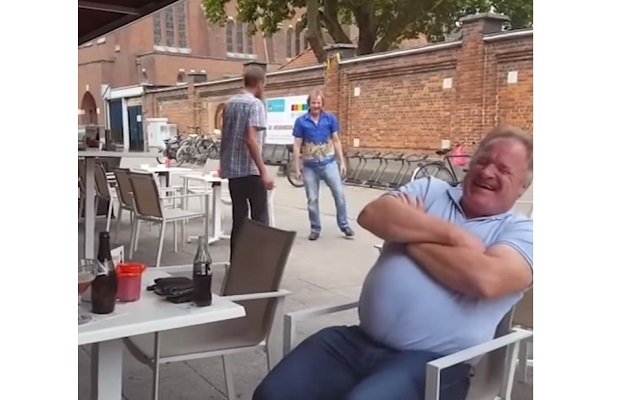
Where is `bottle`? bottle is located at coordinates (203, 266), (108, 284).